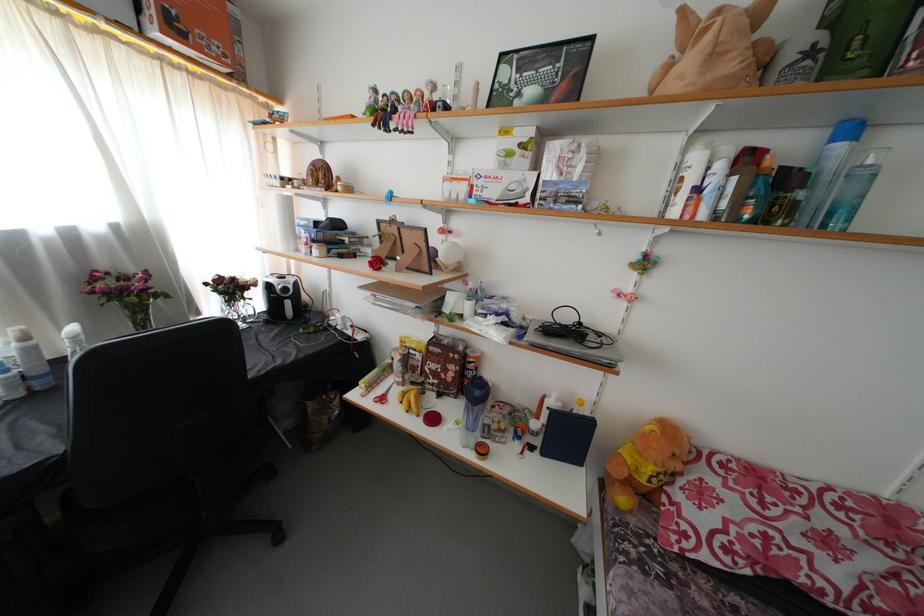
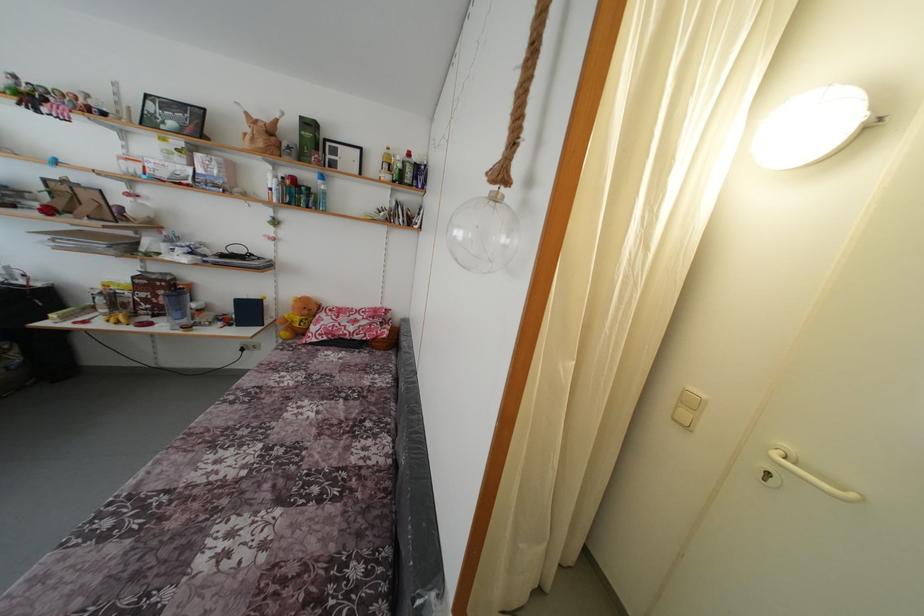
Where in the second image is the point corresponding to point 845,153 from the first image?

(324, 188)